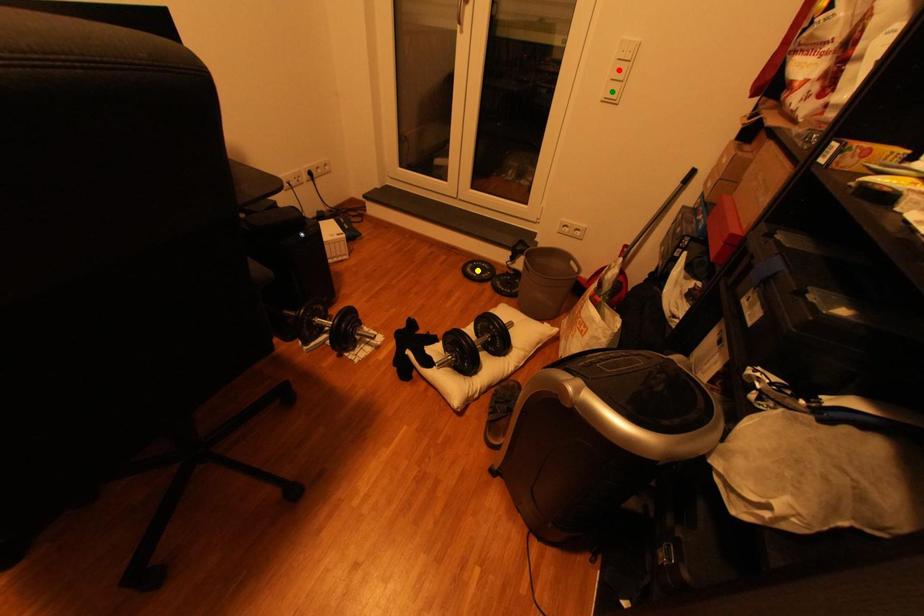
Order these from farthest to nearest:
A) green point
B) red point
C) yellow point

yellow point, green point, red point